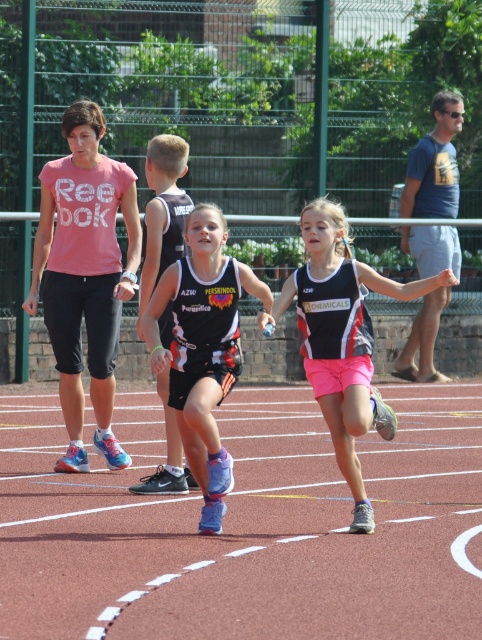
Based on the scene description, which athlete is closer to the starting line? The one wearing the matte black tank top at center or the black jersey at center?

The matte black tank top at center is in front of the black jersey at center, so the athlete wearing the matte black tank top at center is closer to the starting line.